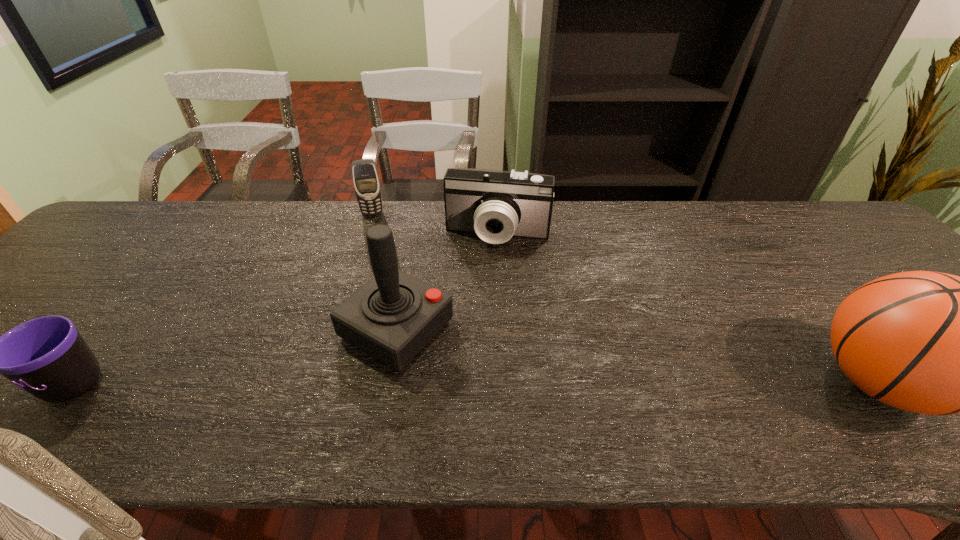
In order to click on vacant space located on the lens of the second farthest object in this screenshot , I will do `click(480, 299)`.

Where is `free space located 0.080m on the lens of the second farthest object`? Image resolution: width=960 pixels, height=540 pixels. free space located 0.080m on the lens of the second farthest object is located at coordinates (487, 270).

In order to click on cellular telephone that is at the far edge in this screenshot , I will do `click(366, 181)`.

I want to click on camcorder situated at the far edge, so click(x=496, y=205).

Image resolution: width=960 pixels, height=540 pixels. Find the location of `object situated at the near edge`. object situated at the near edge is located at coordinates (392, 317).

The width and height of the screenshot is (960, 540). Identify the location of free space at the far edge of the desktop. (190, 204).

Find the location of a particular element. vacant region at the near edge of the desktop is located at coordinates (774, 381).

The image size is (960, 540). What are the coordinates of `vacant space at the far left corner of the desktop` in the screenshot? It's located at (134, 205).

I want to click on vacant space that's between the cellular telephone and the camcorder, so click(x=435, y=225).

This screenshot has width=960, height=540. I want to click on the second closest object to the mug, so click(366, 181).